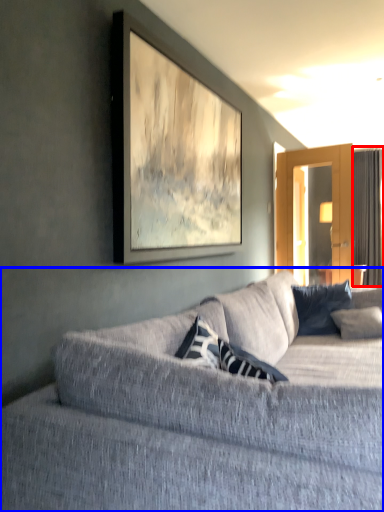
Question: Which object appears closest to the camera in this image, curtain (highlighted by a red box) or studio couch (highlighted by a blue box)?

Choices:
 (A) curtain
 (B) studio couch

Answer: (B)